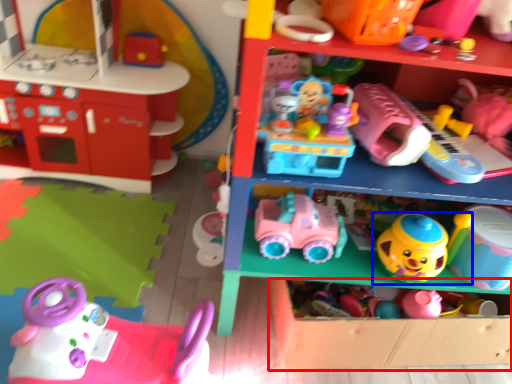
Question: Which object is closer to the camera taking this photo, shelf (highlighted by a red box) or toy (highlighted by a blue box)?

Choices:
 (A) shelf
 (B) toy

Answer: (B)